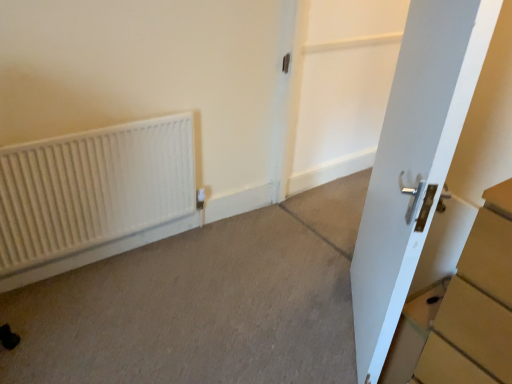
Question: Looking at the image, does white glossy door at center seem bigger or smaller compared to white matte radiator at left?

Choices:
 (A) big
 (B) small

Answer: (A)

Question: Is white glossy door at center to the left or to the right of white matte radiator at left in the image?

Choices:
 (A) left
 (B) right

Answer: (B)

Question: Considering the real-world distances, which object is closest to the white glossy door at right?

Choices:
 (A) white glossy door at center
 (B) gray carpet at lower left
 (C) white matte radiator at left

Answer: (B)

Question: Based on their relative distances, which object is nearer to the white glossy door at right?

Choices:
 (A) gray carpet at lower left
 (B) white glossy door at center
 (C) white matte radiator at left

Answer: (A)